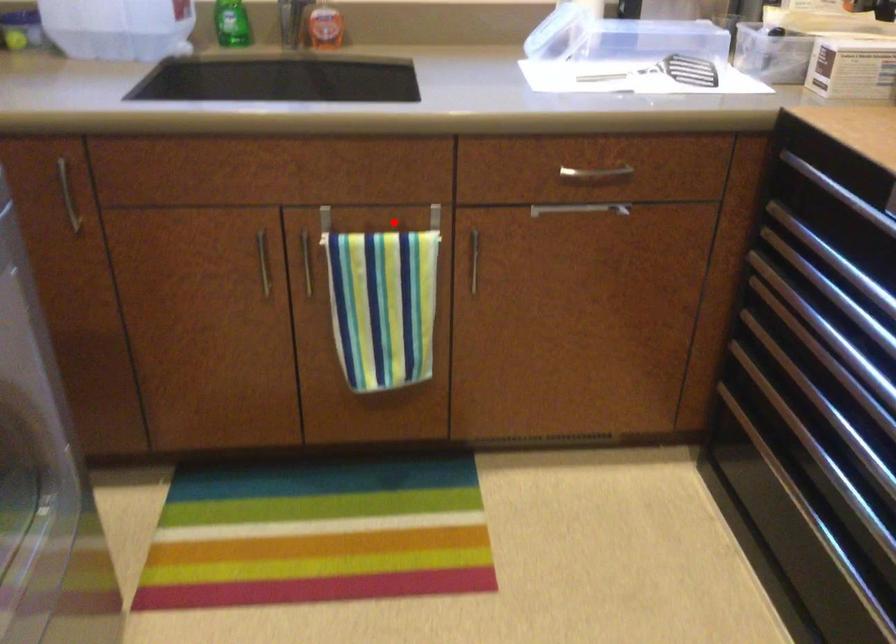
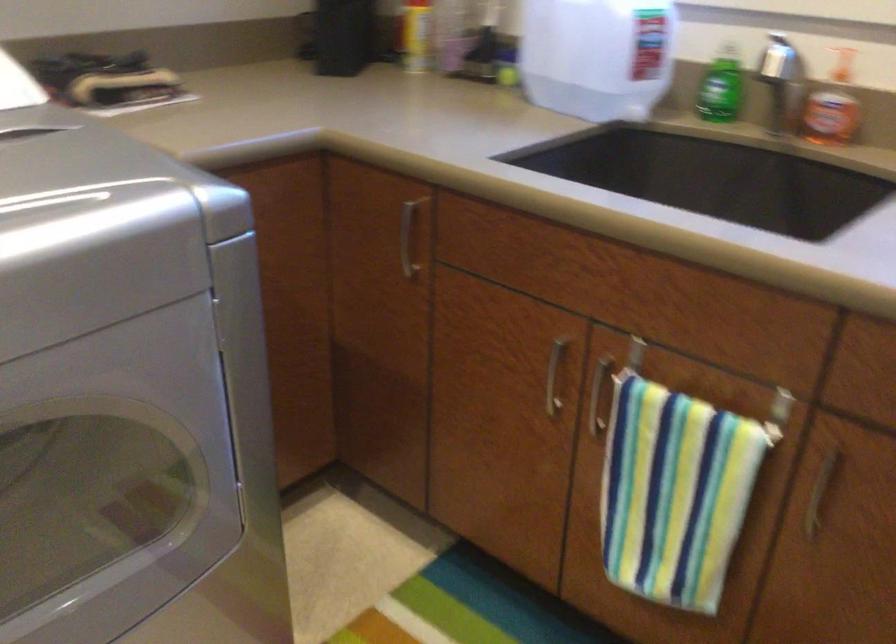
Question: A red point is marked in image1. In image2, is the corresponding 3D point closer to the camera or farther? Reply with the corresponding letter.

Choices:
 (A) The corresponding 3D point is closer.
 (B) The corresponding 3D point is farther.

Answer: (A)